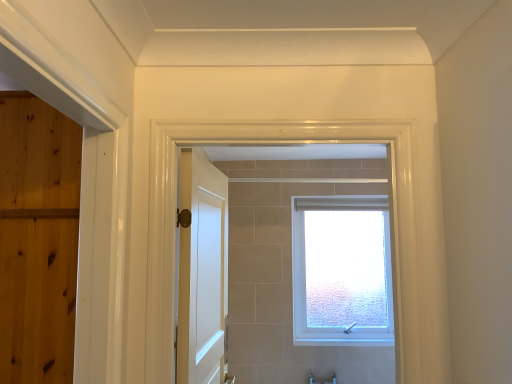
Question: Is point (x=216, y=297) closer or farther from the camera than point (x=327, y=307)?

Choices:
 (A) closer
 (B) farther

Answer: (A)

Question: Is white glossy door at center in front of or behind white frosted glass window at center in the image?

Choices:
 (A) behind
 (B) front

Answer: (B)

Question: From the image's perspective, relative to white frosted glass window at center, is white glossy door at center above or below?

Choices:
 (A) above
 (B) below

Answer: (A)

Question: Is point (370, 299) closer or farther from the camera than point (182, 195)?

Choices:
 (A) farther
 (B) closer

Answer: (A)

Question: Looking at the image, does white frosted glass window at center seem bigger or smaller compared to white glossy door at center?

Choices:
 (A) big
 (B) small

Answer: (A)

Question: Is white frosted glass window at center taller or shorter than white glossy door at center?

Choices:
 (A) tall
 (B) short

Answer: (A)

Question: Based on their positions, is white frosted glass window at center located to the left or right of white glossy door at center?

Choices:
 (A) left
 (B) right

Answer: (B)